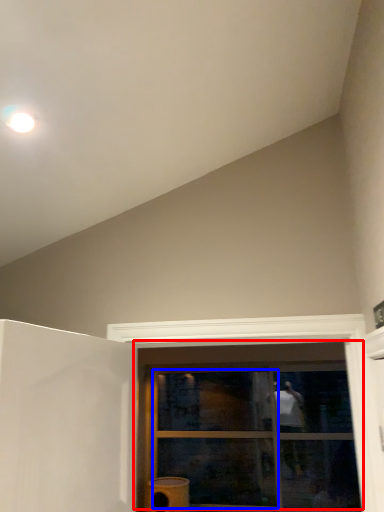
Question: Which object appears closest to the camera in this image, window (highlighted by a red box) or glass door (highlighted by a blue box)?

Choices:
 (A) window
 (B) glass door

Answer: (A)